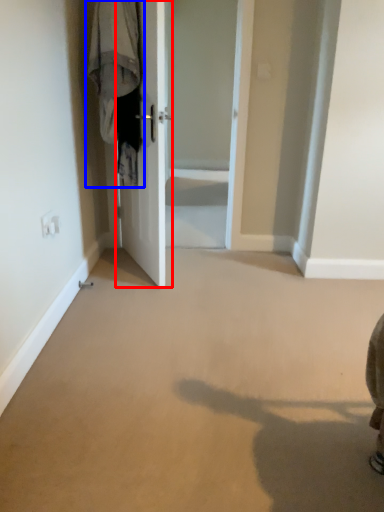
Question: Which object appears farthest to the camera in this image, door (highlighted by a red box) or laundry (highlighted by a blue box)?

Choices:
 (A) door
 (B) laundry

Answer: (B)